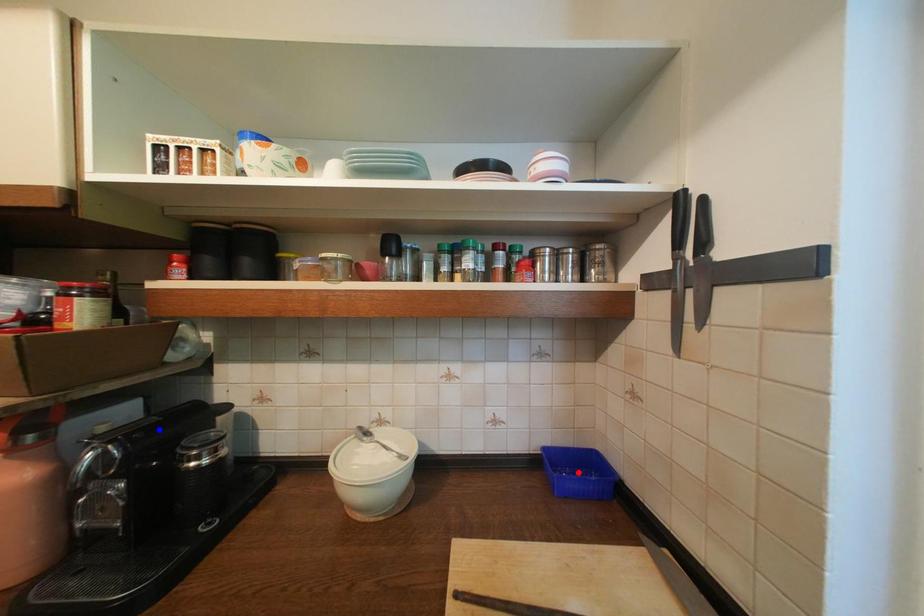
Question: In the image, two points are highlighted. Which point is nearer to the camera? Reply with the corresponding letter.

Choices:
 (A) blue point
 (B) red point

Answer: (A)